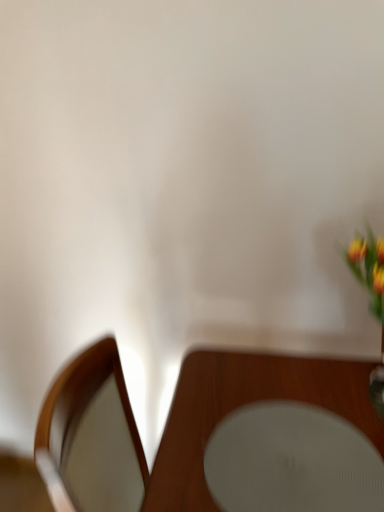
Image resolution: width=384 pixels, height=512 pixels. What do you see at coordinates (292, 462) in the screenshot?
I see `white matte plate at center` at bounding box center [292, 462].

In order to face white matte plate at center, should I rotate leftwards or rightwards?

To face it directly, rotate right by 12.161 degrees.

Find the location of a particular element. white matte plate at center is located at coordinates (292, 462).

Image resolution: width=384 pixels, height=512 pixels. In order to click on white matte plate at center in this screenshot , I will do `click(292, 462)`.